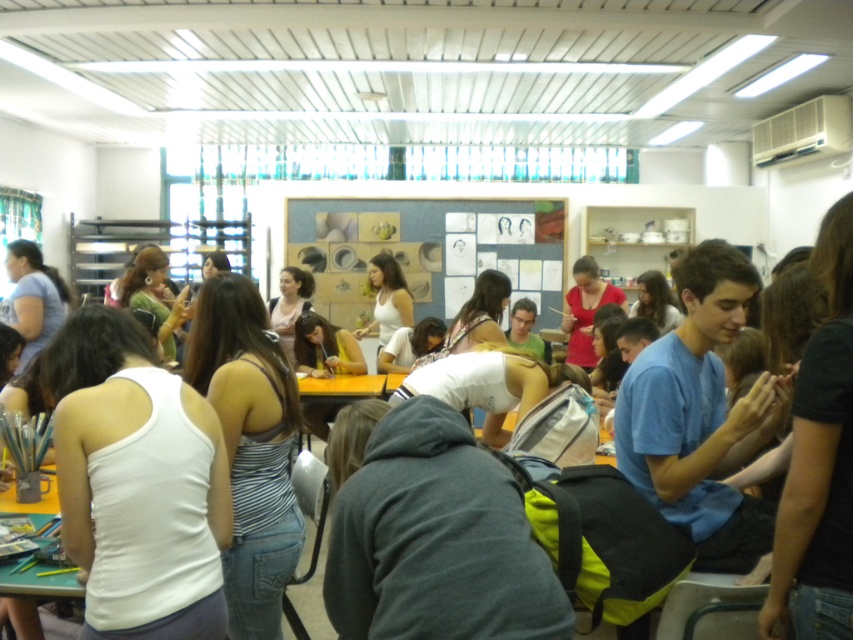
You are an observer looking at the students in the classroom. Which student is wearing the white matte tank top at lower left? Is their clothing positioned higher or lower compared to the striped fabric tank top at center?

The white matte tank top at lower left is above the striped fabric tank top at center, meaning it is positioned higher.

You are a student in the classroom and want to know what is located at the coordinate point specified in the image. What object is at point (137, 483)?

The point (137, 483) marks the white matte tank top at lower left.